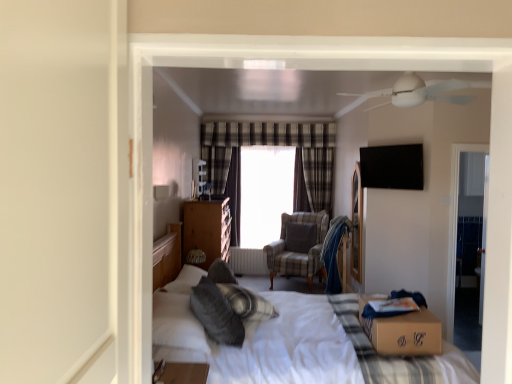
Question: Could you tell me if soft gray pillow at center, the 1th pillow from the front, is turned towards white metallic radiator at center?

Choices:
 (A) no
 (B) yes

Answer: (A)

Question: Is soft gray pillow at center, the 1th pillow from the front, looking in the opposite direction of white metallic radiator at center?

Choices:
 (A) no
 (B) yes

Answer: (A)

Question: From the image's perspective, is soft gray pillow at center, which appears as the 2th pillow when viewed from the right, under white metallic radiator at center?

Choices:
 (A) no
 (B) yes

Answer: (A)

Question: Considering the relative sizes of soft gray pillow at center, which appears as the first pillow when viewed from the left, and white metallic radiator at center in the image provided, is soft gray pillow at center, which appears as the first pillow when viewed from the left, thinner than white metallic radiator at center?

Choices:
 (A) yes
 (B) no

Answer: (B)

Question: Is soft gray pillow at center, the second pillow from the back, taller than white metallic radiator at center?

Choices:
 (A) no
 (B) yes

Answer: (A)

Question: In the image, is white metallic radiator at center positioned in front of or behind plaid fabric armchair at center?

Choices:
 (A) front
 (B) behind

Answer: (B)

Question: Is point (266, 271) positioned closer to the camera than point (311, 266)?

Choices:
 (A) farther
 (B) closer

Answer: (A)

Question: Based on their positions, is white metallic radiator at center located to the left or right of plaid fabric armchair at center?

Choices:
 (A) left
 (B) right

Answer: (A)

Question: From the image's perspective, is white metallic radiator at center positioned above or below plaid fabric armchair at center?

Choices:
 (A) above
 (B) below

Answer: (B)

Question: From the image's perspective, relative to wooden nightstand at center, is plaid fabric curtain at center above or below?

Choices:
 (A) below
 (B) above

Answer: (B)

Question: Looking at the image, does plaid fabric curtain at center seem bigger or smaller compared to wooden nightstand at center?

Choices:
 (A) small
 (B) big

Answer: (A)

Question: Relative to wooden nightstand at center, is plaid fabric curtain at center in front or behind?

Choices:
 (A) behind
 (B) front

Answer: (A)

Question: Do you think plaid fabric curtain at center is within wooden nightstand at center, or outside of it?

Choices:
 (A) outside
 (B) inside

Answer: (A)

Question: From a real-world perspective, is brown cardboard box at center above or below gray fabric pillow at center, arranged as the first pillow when viewed from the right?

Choices:
 (A) below
 (B) above

Answer: (A)

Question: From their relative heights in the image, would you say brown cardboard box at center is taller or shorter than gray fabric pillow at center, the 1th pillow from the back?

Choices:
 (A) short
 (B) tall

Answer: (B)